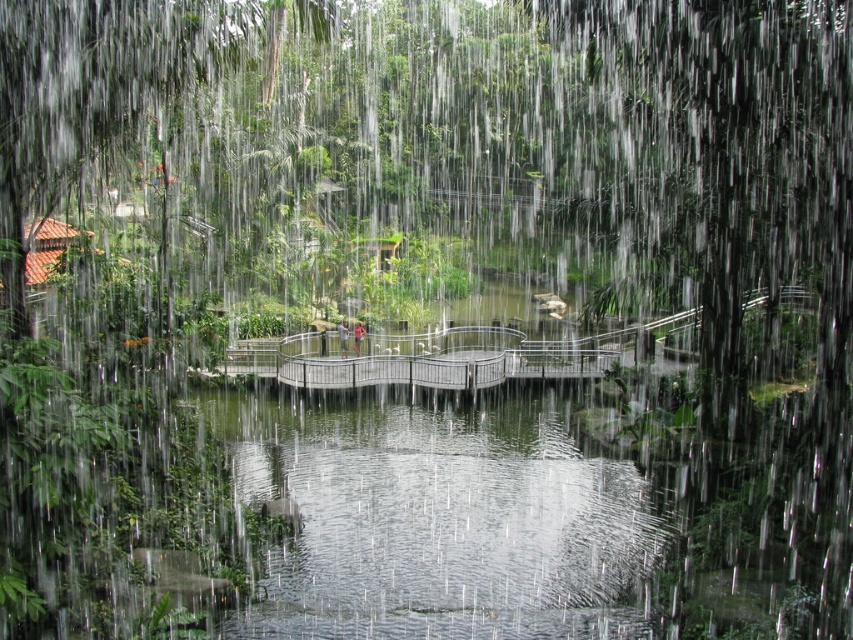
Question: Does light brown wooden bridge at center appear under skinny jeans at center?

Choices:
 (A) no
 (B) yes

Answer: (A)

Question: Does metallic gray bridge at center have a greater width compared to skinny jeans at center?

Choices:
 (A) no
 (B) yes

Answer: (B)

Question: Which point is closer to the camera?

Choices:
 (A) skinny jeans at center
 (B) metallic gray bridge at center
 (C) light brown wooden bridge at center

Answer: (B)

Question: Which of these objects is positioned farthest from the skinny jeans at center?

Choices:
 (A) light brown wooden bridge at center
 (B) metallic gray bridge at center

Answer: (B)

Question: Is metallic gray bridge at center behind light brown wooden bridge at center?

Choices:
 (A) no
 (B) yes

Answer: (A)

Question: Which of the following is the closest to the observer?

Choices:
 (A) light brown wooden bridge at center
 (B) skinny jeans at center

Answer: (B)